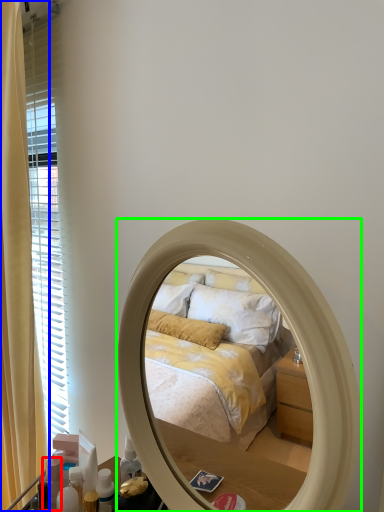
Question: Considering the real-world distances, which object is farthest from toiletry (highlighted by a red box)? curtain (highlighted by a blue box) or mirror (highlighted by a green box)?

Choices:
 (A) curtain
 (B) mirror

Answer: (A)